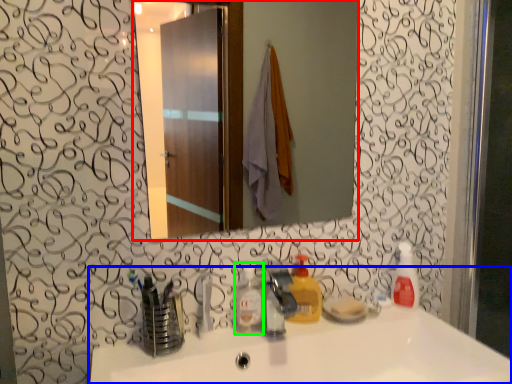
Question: Estimate the real-world distances between objects in this image. Which object is farther from mirror (highlighted by a red box), sink (highlighted by a blue box) or bottle (highlighted by a green box)?

Choices:
 (A) sink
 (B) bottle

Answer: (B)